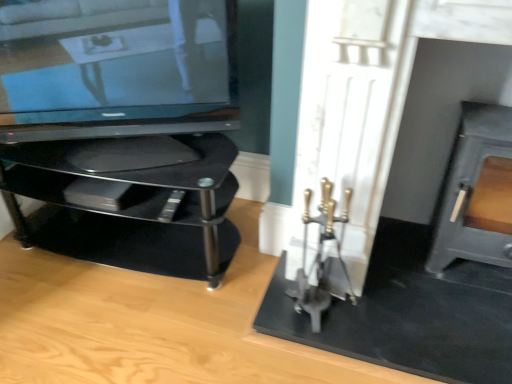
Question: Is satin black tv at left wider than black glass tv stand at left?

Choices:
 (A) no
 (B) yes

Answer: (A)

Question: Considering the relative positions of satin black tv at left and black glass tv stand at left in the image provided, is satin black tv at left to the right of black glass tv stand at left from the viewer's perspective?

Choices:
 (A) yes
 (B) no

Answer: (A)

Question: Can you confirm if satin black tv at left is thinner than black glass tv stand at left?

Choices:
 (A) no
 (B) yes

Answer: (B)

Question: Is satin black tv at left positioned far away from black glass tv stand at left?

Choices:
 (A) yes
 (B) no

Answer: (B)

Question: Is satin black tv at left at the left side of black glass tv stand at left?

Choices:
 (A) no
 (B) yes

Answer: (A)

Question: Would you say satin black tv at left is outside black glass tv stand at left?

Choices:
 (A) yes
 (B) no

Answer: (A)

Question: From the image's perspective, is matte gray fireplace at right located beneath black glass tv stand at left?

Choices:
 (A) yes
 (B) no

Answer: (B)

Question: From a real-world perspective, does matte gray fireplace at right sit lower than black glass tv stand at left?

Choices:
 (A) no
 (B) yes

Answer: (A)

Question: Is matte gray fireplace at right further to the viewer compared to black glass tv stand at left?

Choices:
 (A) yes
 (B) no

Answer: (B)

Question: Can you confirm if matte gray fireplace at right is smaller than black glass tv stand at left?

Choices:
 (A) no
 (B) yes

Answer: (B)

Question: Does matte gray fireplace at right have a lesser height compared to black glass tv stand at left?

Choices:
 (A) no
 (B) yes

Answer: (A)

Question: Is black glass tv stand at left at the back of matte gray fireplace at right?

Choices:
 (A) yes
 (B) no

Answer: (B)

Question: Can you confirm if black glass tv stand at left is shorter than satin black tv at left?

Choices:
 (A) yes
 (B) no

Answer: (A)